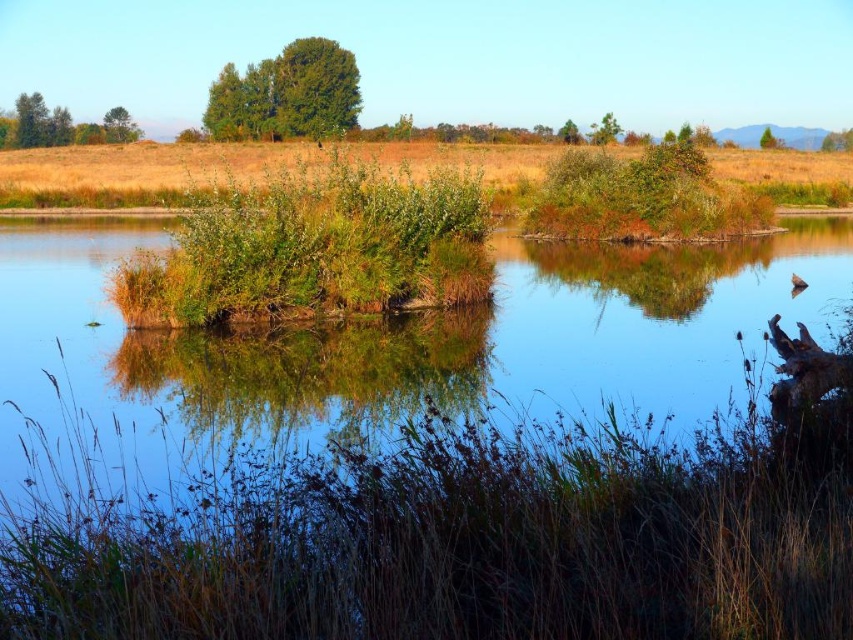
Does green matte tree at upper left have a lesser height compared to green leafy tree at upper left?

No.

The width and height of the screenshot is (853, 640). What do you see at coordinates (61, 125) in the screenshot?
I see `green matte tree at upper left` at bounding box center [61, 125].

The image size is (853, 640). In order to click on green matte tree at upper left in this screenshot , I will do `click(61, 125)`.

Does brown dry grass at lower center appear on the left side of green grass at center?

In fact, brown dry grass at lower center is to the right of green grass at center.

Is brown dry grass at lower center positioned in front of green grass at center?

Yes, it is in front of green grass at center.

Find the location of a particular element. The height and width of the screenshot is (640, 853). brown dry grass at lower center is located at coordinates (473, 544).

Does brown dry grass at lower center have a lesser width compared to green matte tree at upper center?

No.

Between brown dry grass at lower center and green matte tree at upper center, which one is positioned higher?

Positioned higher is green matte tree at upper center.

Consider the image. Who is more distant from viewer, (x=409, y=608) or (x=576, y=131)?

The point (x=576, y=131) is behind.

The image size is (853, 640). Identify the location of brown dry grass at lower center. (473, 544).